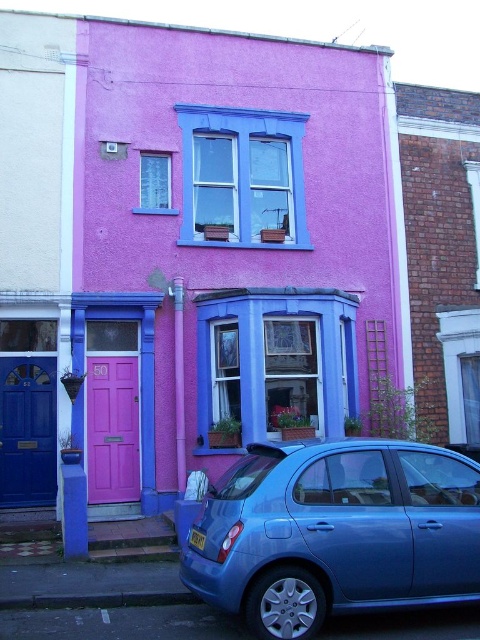
Question: Is matte blue door at left to the left of pink matte door at center from the viewer's perspective?

Choices:
 (A) no
 (B) yes

Answer: (B)

Question: Is metallic blue hatchback at lower center bigger than pink matte door at center?

Choices:
 (A) no
 (B) yes

Answer: (B)

Question: Among these objects, which one is nearest to the camera?

Choices:
 (A) metallic blue hatchback at lower center
 (B) pink matte door at center

Answer: (A)

Question: Which point is farther to the camera?

Choices:
 (A) (15, 378)
 (B) (129, 422)
 (C) (276, 522)

Answer: (B)

Question: Is metallic blue hatchback at lower center positioned in front of pink matte door at center?

Choices:
 (A) no
 (B) yes

Answer: (B)

Question: Estimate the real-world distances between objects in this image. Which object is closer to the metallic blue hatchback at lower center?

Choices:
 (A) pink matte door at center
 (B) matte blue door at left

Answer: (A)